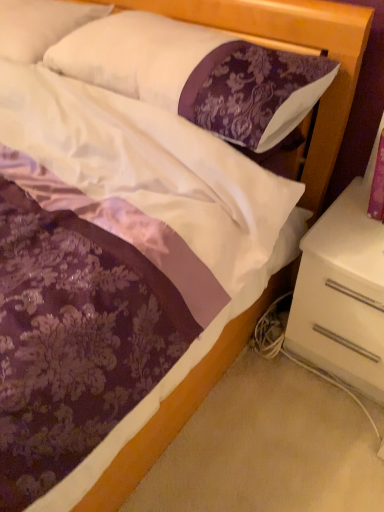
Question: Is white glossy nightstand at lower right to the right of white soft pillow at upper left, the 1th pillow from the left, from the viewer's perspective?

Choices:
 (A) yes
 (B) no

Answer: (A)

Question: Is white soft pillow at upper left, the second pillow positioned from the right, completely or partially inside white glossy nightstand at lower right?

Choices:
 (A) no
 (B) yes

Answer: (A)

Question: Is the depth of white glossy nightstand at lower right greater than that of white soft pillow at upper left, the second pillow positioned from the right?

Choices:
 (A) no
 (B) yes

Answer: (A)

Question: Can you confirm if white glossy nightstand at lower right is positioned to the left of white soft pillow at upper left, the second pillow positioned from the right?

Choices:
 (A) yes
 (B) no

Answer: (B)

Question: Considering the relative sizes of white glossy nightstand at lower right and white soft pillow at upper left, the second pillow positioned from the right, in the image provided, is white glossy nightstand at lower right taller than white soft pillow at upper left, the second pillow positioned from the right,?

Choices:
 (A) no
 (B) yes

Answer: (B)

Question: Is point (336, 64) positioned closer to the camera than point (359, 261)?

Choices:
 (A) farther
 (B) closer

Answer: (A)

Question: Looking at the image, does purple damask pillow at upper center, the 2th pillow when ordered from left to right, seem bigger or smaller compared to white glossy nightstand at lower right?

Choices:
 (A) big
 (B) small

Answer: (B)

Question: From a real-world perspective, is purple damask pillow at upper center, acting as the first pillow starting from the right, physically located above or below white glossy nightstand at lower right?

Choices:
 (A) above
 (B) below

Answer: (A)

Question: In terms of width, does purple damask pillow at upper center, acting as the first pillow starting from the right, look wider or thinner when compared to white glossy nightstand at lower right?

Choices:
 (A) wide
 (B) thin

Answer: (B)

Question: From their relative heights in the image, would you say white glossy nightstand at lower right is taller or shorter than white soft pillow at upper left, the second pillow positioned from the right?

Choices:
 (A) short
 (B) tall

Answer: (B)

Question: Does point click(382, 390) appear closer or farther from the camera than point click(41, 44)?

Choices:
 (A) closer
 (B) farther

Answer: (B)

Question: From a real-world perspective, is white glossy nightstand at lower right positioned above or below white soft pillow at upper left, the 1th pillow from the left?

Choices:
 (A) above
 (B) below

Answer: (B)

Question: Is white glossy nightstand at lower right bigger or smaller than white soft pillow at upper left, the 1th pillow from the left?

Choices:
 (A) small
 (B) big

Answer: (B)

Question: From a real-world perspective, relative to purple damask pillow at upper center, acting as the first pillow starting from the right, is white glossy nightstand at lower right vertically above or below?

Choices:
 (A) above
 (B) below

Answer: (B)

Question: Relative to purple damask pillow at upper center, acting as the first pillow starting from the right, is white glossy nightstand at lower right in front or behind?

Choices:
 (A) front
 (B) behind

Answer: (B)